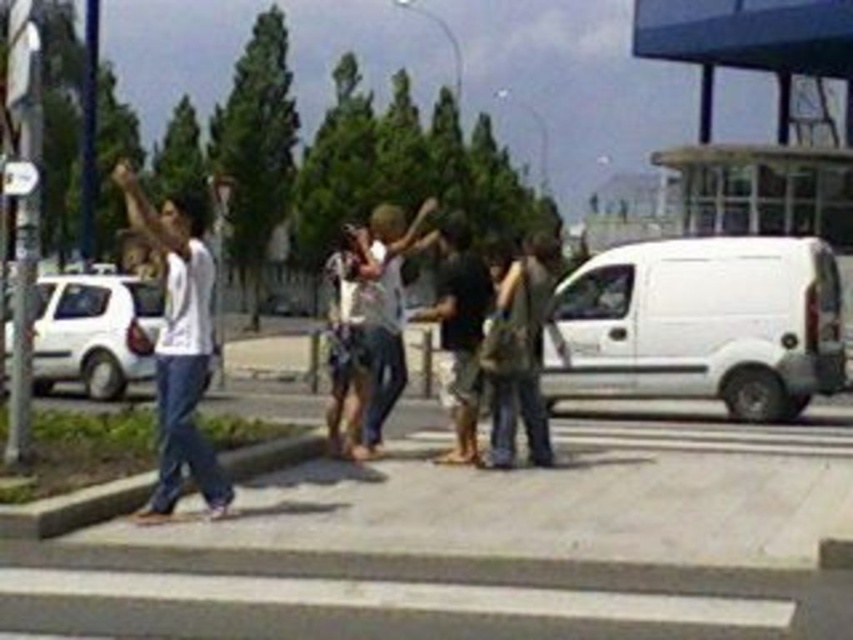
The image size is (853, 640). What do you see at coordinates (488, 540) in the screenshot? I see `gray concrete pavement at center` at bounding box center [488, 540].

Is point (628, 560) positioned before point (189, 410)?

Yes, it is.

Locate an element on the screen. gray concrete pavement at center is located at coordinates (488, 540).

Is white matte van at right above light brown leather jacket at center?

No, white matte van at right is not above light brown leather jacket at center.

Is point (799, 310) farther from camera compared to point (372, 288)?

Yes, it is behind point (372, 288).

Does point (593, 372) lie in front of point (380, 349)?

No, it is not.

Locate an element on the screen. The height and width of the screenshot is (640, 853). white matte van at right is located at coordinates (701, 324).

Which is in front, point (521, 381) or point (375, 422)?

Point (521, 381) is more forward.

Where is `camouflage fabric shirt at center`? The height and width of the screenshot is (640, 853). camouflage fabric shirt at center is located at coordinates (520, 353).